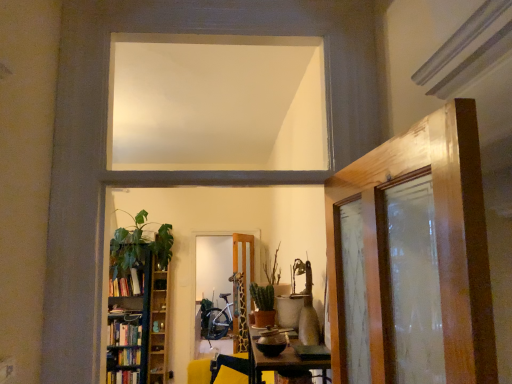
This screenshot has height=384, width=512. Find the location of `wooden bookshelf at left`. wooden bookshelf at left is located at coordinates (138, 324).

This screenshot has width=512, height=384. I want to click on yellow fabric swivel chair at center, so click(x=230, y=376).

This screenshot has height=384, width=512. Describe the element at coordinates (126, 284) in the screenshot. I see `hardcover books at left` at that location.

Identify the location of green matte cactus at center, the 2th plant in the back-to-front sequence. (263, 296).

Is green matte plant at center, the 1th plant from the back, facing away from yellow fabric swivel chair at center?

That's not correct — green matte plant at center, the 1th plant from the back, is not looking away from yellow fabric swivel chair at center.

Is green matte plant at center, the 1th plant from the back, further to the viewer compared to yellow fabric swivel chair at center?

No, it is not.

Considering the sizes of green matte plant at center, the 2th plant viewed from the front, and yellow fabric swivel chair at center in the image, is green matte plant at center, the 2th plant viewed from the front, bigger or smaller than yellow fabric swivel chair at center?

Considering their sizes, green matte plant at center, the 2th plant viewed from the front, takes up less space than yellow fabric swivel chair at center.

Where is `houseplant that is above the hardcover books at left (from a real-world perspective)`? houseplant that is above the hardcover books at left (from a real-world perspective) is located at coordinates (139, 245).

Which is more to the left, green leafy plant at left or hardcover books at left?

hardcover books at left.

From a real-world perspective, is wooden door at center on top of green leafy plant at left?

No, from a real-world perspective, wooden door at center is not on top of green leafy plant at left.

Considering the sizes of objects wooden door at center and green leafy plant at left in the image provided, who is smaller, wooden door at center or green leafy plant at left?

Result: Smaller between the two is wooden door at center.

Is wooden door at center looking in the opposite direction of green leafy plant at left?

No, wooden door at center is not facing the opposite direction of green leafy plant at left.

Is point (240, 303) farther from viewer compared to point (123, 284)?

No, (240, 303) is closer to viewer.

From a real-world perspective, which is physically above, wooden door at center or hardcover books at left?

hardcover books at left, from a real-world perspective.

Could you tell me if wooden door at center is facing hardcover books at left?

Yes, wooden door at center faces towards hardcover books at left.

What's the angular difference between green matte plant at center, the 1th plant from the back, and green leafy plant at left's facing directions?

94.9 degrees separate the facing orientations of green matte plant at center, the 1th plant from the back, and green leafy plant at left.

Is green matte plant at center, the 2th plant viewed from the front, at the left side of green leafy plant at left?

In fact, green matte plant at center, the 2th plant viewed from the front, is to the right of green leafy plant at left.

Which of these two, green matte plant at center, the 2th plant viewed from the front, or green leafy plant at left, is bigger?

Bigger between the two is green leafy plant at left.

Is green matte plant at center, the 2th plant viewed from the front, closer to the viewer compared to green leafy plant at left?

That is True.

Considering the sizes of objects green matte cactus at center, the 2th plant in the back-to-front sequence, and wooden shelf at left in the image provided, who is shorter, green matte cactus at center, the 2th plant in the back-to-front sequence, or wooden shelf at left?

Standing shorter between the two is green matte cactus at center, the 2th plant in the back-to-front sequence.

Does green matte cactus at center, which is counted as the 1th plant, starting from the front, have a larger size compared to wooden shelf at left?

No.

From a real-world perspective, is green matte cactus at center, the 2th plant in the back-to-front sequence, physically below wooden shelf at left?

No, from a real-world perspective, green matte cactus at center, the 2th plant in the back-to-front sequence, is not below wooden shelf at left.

Is green matte cactus at center, which is counted as the 1th plant, starting from the front, positioned before wooden shelf at left?

Yes, the depth of green matte cactus at center, which is counted as the 1th plant, starting from the front, is less than that of wooden shelf at left.

From the image's perspective, does wooden shelf at left appear higher than green matte plant at center, the 2th plant viewed from the front?

No.

From a real-world perspective, is wooden shelf at left below green matte plant at center, the 1th plant from the back?

Yes, from a real-world perspective, wooden shelf at left is below green matte plant at center, the 1th plant from the back.

How much distance is there between wooden shelf at left and green matte plant at center, the 1th plant from the back?

wooden shelf at left is 2.45 meters from green matte plant at center, the 1th plant from the back.

Can you tell me how much wooden shelf at left and green matte plant at center, the 2th plant viewed from the front, differ in facing direction?

The facing directions of wooden shelf at left and green matte plant at center, the 2th plant viewed from the front, are 94 degrees apart.

Locate an element on the screen. The height and width of the screenshot is (384, 512). swivel chair located on the left of green matte plant at center, the 1th plant from the back is located at coordinates (230, 376).

The height and width of the screenshot is (384, 512). I want to click on houseplant located above the hardcover books at left (from the image's perspective), so click(x=139, y=245).

Considering their positions, is wooden shelf at left positioned closer to green matte plant at center, the 2th plant viewed from the front, than green leafy plant at left?

Based on the image, green leafy plant at left appears to be nearer to green matte plant at center, the 2th plant viewed from the front.

Consider the image. Considering their positions, is wooden door at center positioned closer to wooden bookshelf at left than white matte window at upper center?

The object closer to wooden bookshelf at left is wooden door at center.

From the picture: Looking at the image, which one is located closer to green matte cactus at center, which is counted as the 1th plant, starting from the front, wooden bookshelf at left or wooden door at center?

wooden door at center is closer to green matte cactus at center, which is counted as the 1th plant, starting from the front.

Based on their spatial positions, is wooden shelf at left or green leafy plant at left further from hardcover books at left?

wooden shelf at left lies further to hardcover books at left than the other object.

Estimate the real-world distances between objects in this image. Which object is further from hardcover books at left, green leafy plant at left or white matte window at upper center?

white matte window at upper center lies further to hardcover books at left than the other object.

When comparing their distances from wooden shelf at left, does green matte cactus at center, which is counted as the 1th plant, starting from the front, or yellow fabric swivel chair at center seem further?

The object further to wooden shelf at left is green matte cactus at center, which is counted as the 1th plant, starting from the front.

Based on their spatial positions, is wooden bookshelf at left or wooden shelf at left further from green leafy plant at left?

wooden shelf at left.

Consider the image. Looking at the image, which one is located further to yellow fabric swivel chair at center, white matte window at upper center or wooden door at center?

white matte window at upper center.

Find the location of a particular element. shelf between hardcover books at left and wooden bookshelf at left from top to bottom is located at coordinates (158, 324).

The image size is (512, 384). I want to click on houseplant located between green matte cactus at center, which is counted as the 1th plant, starting from the front, and wooden shelf at left in the depth direction, so click(139, 245).

Find the location of a particular element. bookcase located between green matte plant at center, the 1th plant from the back, and hardcover books at left in the depth direction is located at coordinates (138, 324).

This screenshot has height=384, width=512. What are the coordinates of `houseplant positioned between yellow fabric swivel chair at center and wooden shelf at left from near to far` in the screenshot? It's located at (139, 245).